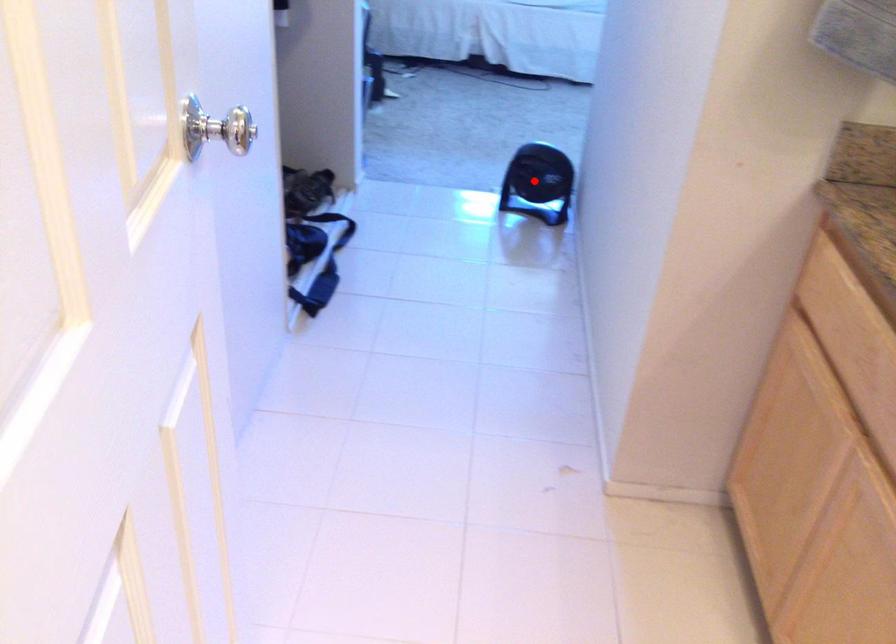
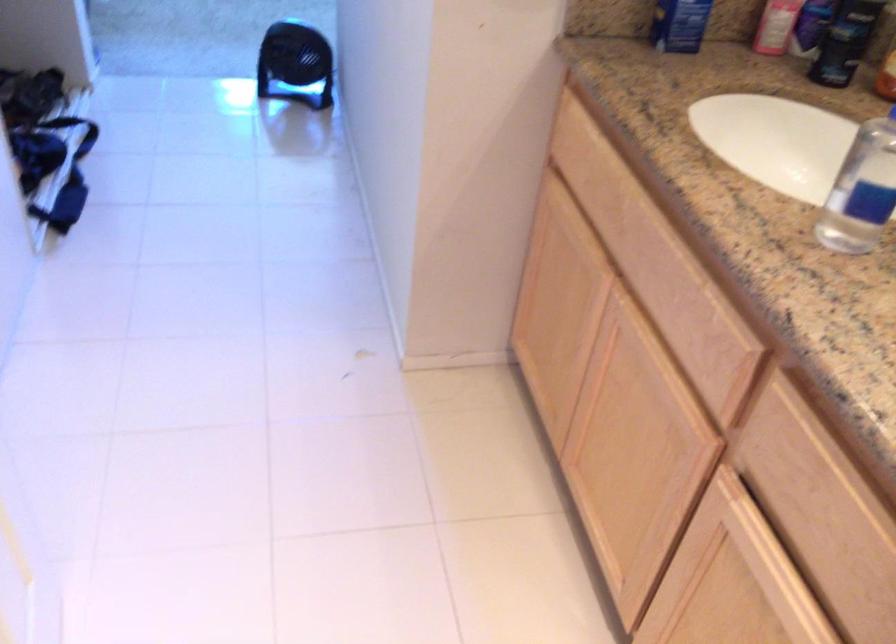
The point at the highlighted location is marked in the first image. Where is the corresponding point in the second image?

(295, 64)